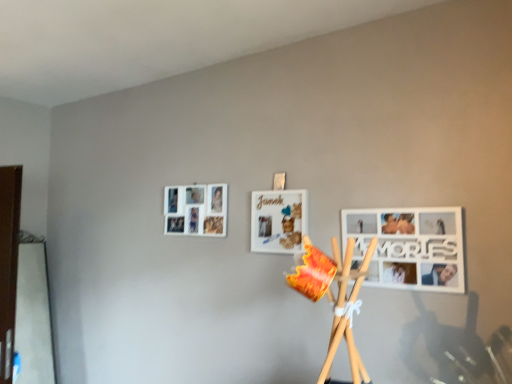
Question: From a real-world perspective, is white matte picture frame at upper left, the 1th picture frame from the left, positioned above or below white matte picture frame at center, positioned as the second picture frame in right-to-left order?

Choices:
 (A) above
 (B) below

Answer: (A)

Question: Is white matte picture frame at upper left, positioned as the 1th picture frame in back-to-front order, in front of or behind white matte picture frame at center, positioned as the second picture frame in right-to-left order, in the image?

Choices:
 (A) behind
 (B) front

Answer: (A)

Question: Which of these objects is positioned closest to the white matte picture frame at upper left, positioned as the 1th picture frame in back-to-front order?

Choices:
 (A) white matte picture frame at lower right, the third picture frame in the back-to-front sequence
 (B) white matte picture frame at center, positioned as the second picture frame in right-to-left order

Answer: (B)

Question: Which object is positioned farthest from the white matte picture frame at upper left, the 1th picture frame from the left?

Choices:
 (A) white matte picture frame at lower right, the first picture frame in the right-to-left sequence
 (B) white matte picture frame at center, positioned as the second picture frame in right-to-left order

Answer: (A)